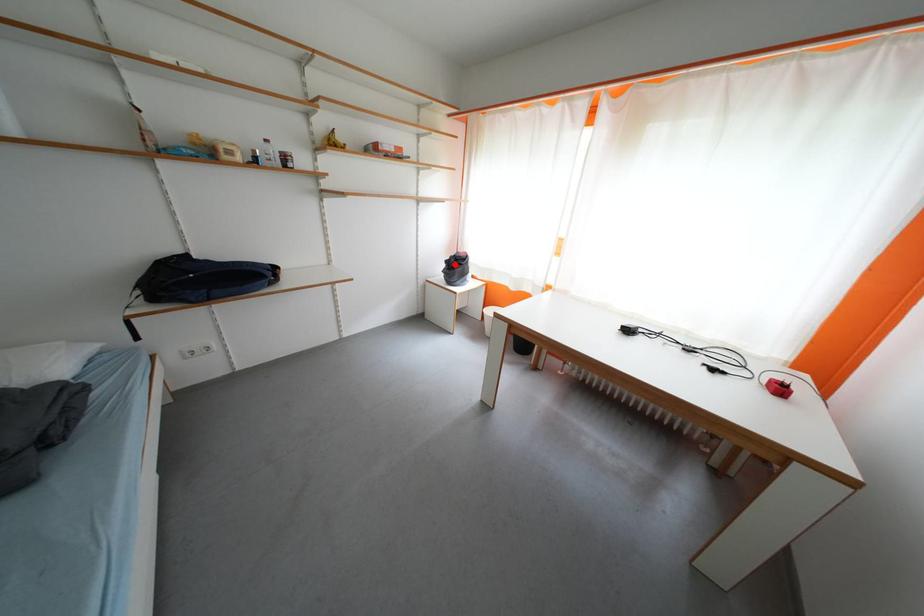
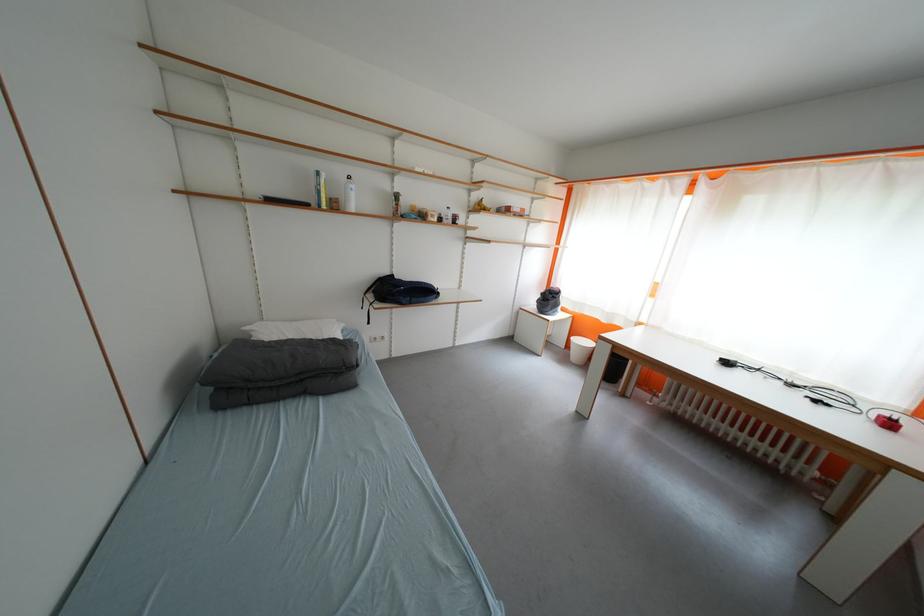
Find the pixel in the second image that matches the highlighted location in the first image.

(551, 297)